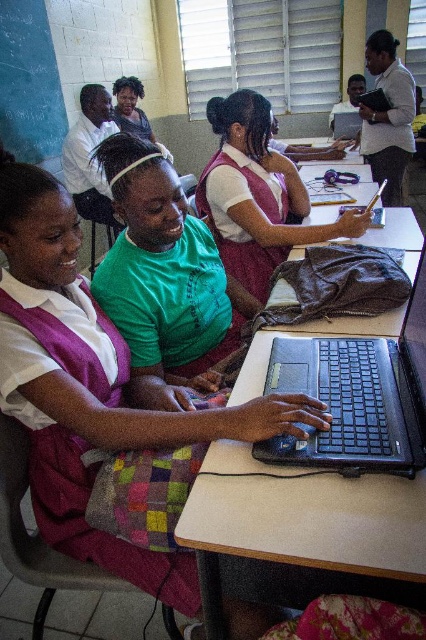
You are a tailor who needs to create a new uniform for the students. You observe the two uniforms in the image, the matte purple vest at center and the matte pink uniform at center. Which uniform requires more fabric in terms of width?

The matte purple vest at center requires more fabric in terms of width because its width is larger than the matte pink uniform at center.

You are a student trying to reach the black matte laptop at center to grab a USB drive. There is a matte purple vest at center blocking your path. Can you reach the laptop without moving the vest?

The matte purple vest at center is closer to you than the black matte laptop at center, so you can reach around or behind it to access the laptop without moving the vest.